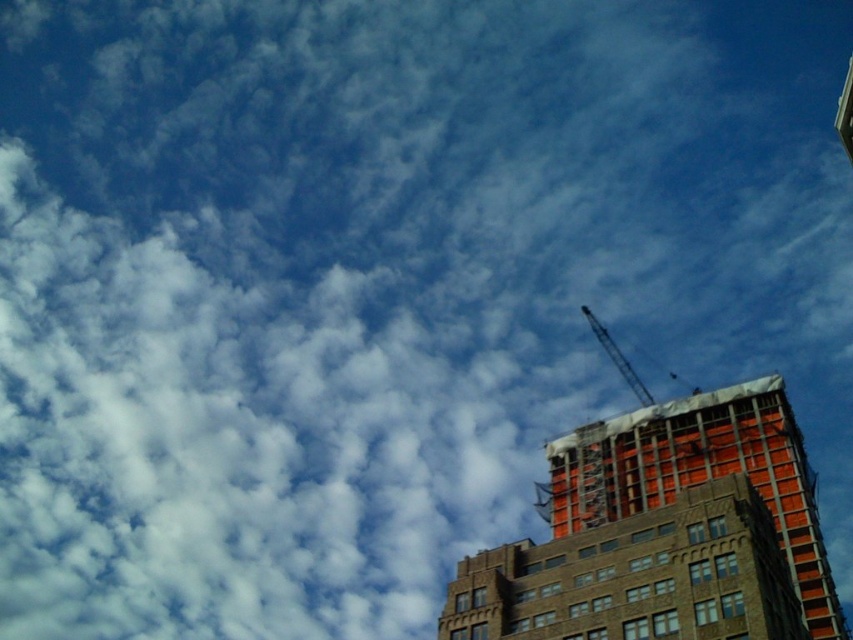
You are a construction worker planning to move a heavy load from the orange brick building at upper right to the metallic gray crane at upper right. Which object is closer to you so you can start the operation?

The orange brick building at upper right is closer to the viewer than the metallic gray crane at upper right, so you should start the operation from the orange brick building at upper right.